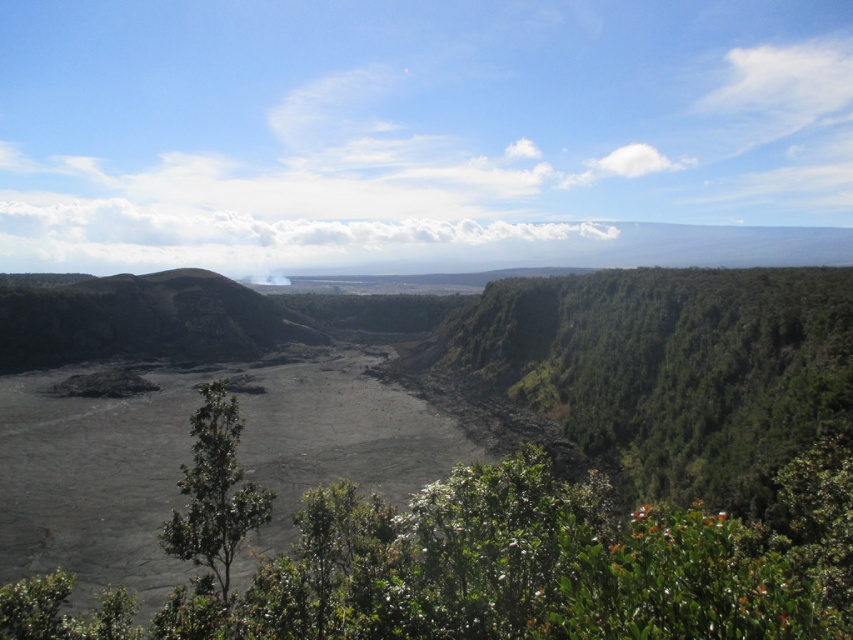
Is green leafy shrubs at center wider than green leafy tree at center?

Indeed, green leafy shrubs at center has a greater width compared to green leafy tree at center.

Can you confirm if green leafy shrubs at center is positioned to the right of green leafy tree at center?

Indeed, green leafy shrubs at center is positioned on the right side of green leafy tree at center.

Is point (846, 552) farther from camera compared to point (189, 422)?

No, (846, 552) is in front of (189, 422).

You are a GUI agent. You are given a task and a screenshot of the screen. Output one action in this format:
    pyautogui.click(x=<x>, y=<y>)
    Task: Click on the green leafy shrubs at center
    
    Given the screenshot: What is the action you would take?
    pyautogui.click(x=479, y=560)

Is green leafy shrubs at center wider than volcanic rock mountain at left?

Incorrect, green leafy shrubs at center's width does not surpass volcanic rock mountain at left's.

Can you confirm if green leafy shrubs at center is positioned to the right of volcanic rock mountain at left?

Yes, green leafy shrubs at center is to the right of volcanic rock mountain at left.

Which is behind, point (450, 604) or point (93, 332)?

Positioned behind is point (93, 332).

Image resolution: width=853 pixels, height=640 pixels. I want to click on green leafy shrubs at center, so click(x=479, y=560).

Is green leafy shrubs at center further to the viewer compared to white smoke at center?

No.

Based on the photo, does green leafy shrubs at center appear over white smoke at center?

No.

Is point (805, 458) closer to viewer compared to point (259, 276)?

Yes, it is in front of point (259, 276).

Where is `green leafy shrubs at center`? Image resolution: width=853 pixels, height=640 pixels. green leafy shrubs at center is located at coordinates (479, 560).